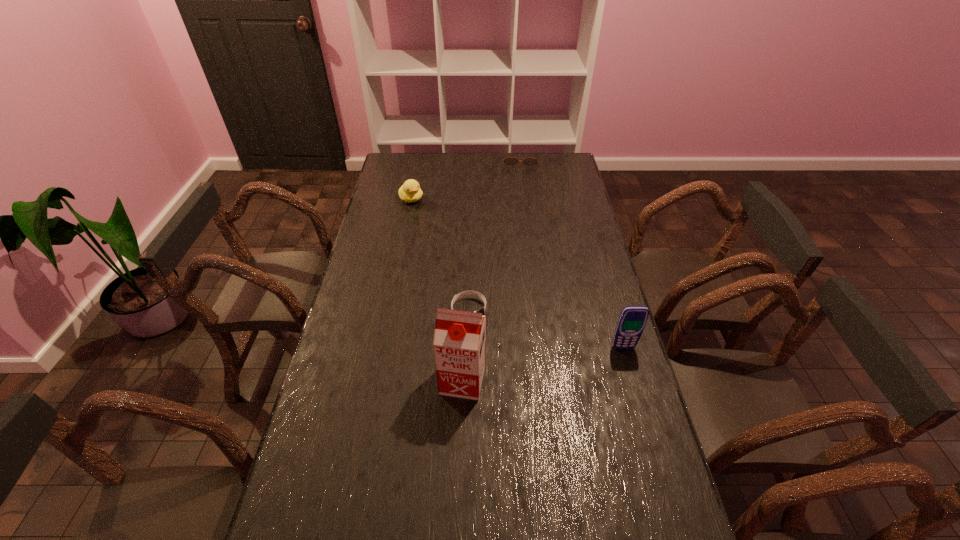
The image size is (960, 540). I want to click on object situated at the far edge, so click(x=510, y=161).

In order to click on object that is at the left edge in this screenshot , I will do `click(410, 191)`.

Find the location of a particular element. object present at the right edge is located at coordinates (632, 320).

This screenshot has height=540, width=960. In the image, there is a desktop. Identify the location of free space at the near edge. (433, 514).

Locate an element on the screen. This screenshot has height=540, width=960. vacant space at the left edge of the desktop is located at coordinates (400, 222).

Locate an element on the screen. This screenshot has width=960, height=540. blank area at the right edge is located at coordinates coord(551,192).

You are a GUI agent. You are given a task and a screenshot of the screen. Output one action in this format:
    pyautogui.click(x=<x>, y=<y>)
    Task: Click on the vacant space at the far right corner of the desktop
    The image size is (960, 540).
    Given the screenshot: What is the action you would take?
    pyautogui.click(x=558, y=167)

Where is `free space at the near right corner of the desktop`? This screenshot has height=540, width=960. free space at the near right corner of the desktop is located at coordinates (675, 502).

I want to click on free space between the wristband and the duckling, so click(440, 254).

You are a GUI agent. You are given a task and a screenshot of the screen. Output one action in this format:
    pyautogui.click(x=<x>, y=<y>)
    Task: Click on the free point between the leftmost object and the wristband
    
    Given the screenshot: What is the action you would take?
    pyautogui.click(x=440, y=254)